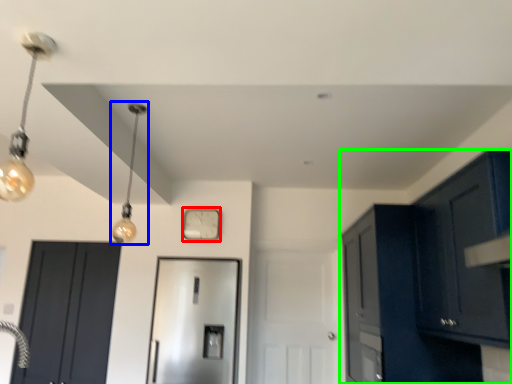
Question: Which object is the closest to the clock (highlighted by a red box)? Choose among these: light (highlighted by a blue box) or cabinetry (highlighted by a green box).

Choices:
 (A) light
 (B) cabinetry

Answer: (A)